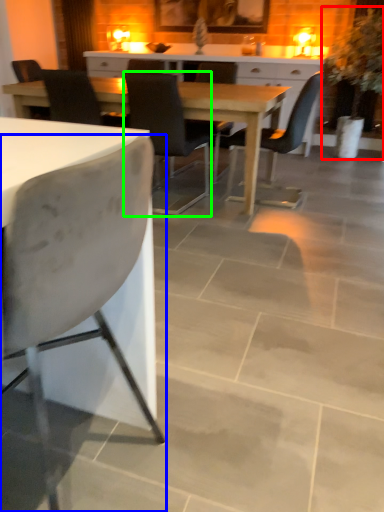
Question: Which is nearer to the houseplant (highlighted by a red box)? chair (highlighted by a blue box) or chair (highlighted by a green box).

Choices:
 (A) chair
 (B) chair

Answer: (B)